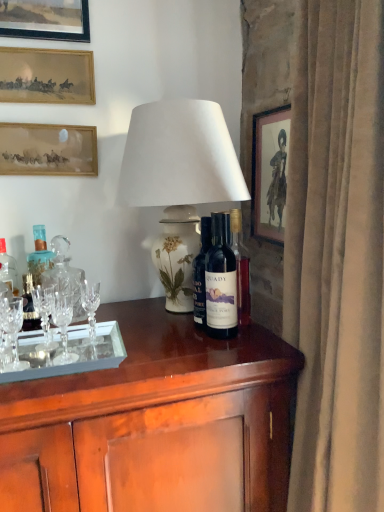
Locate an element on the screen. vacant space positioned to the left of dark blue glass bottle at center, which is counted as the third bottle, starting from the left is located at coordinates (146, 339).